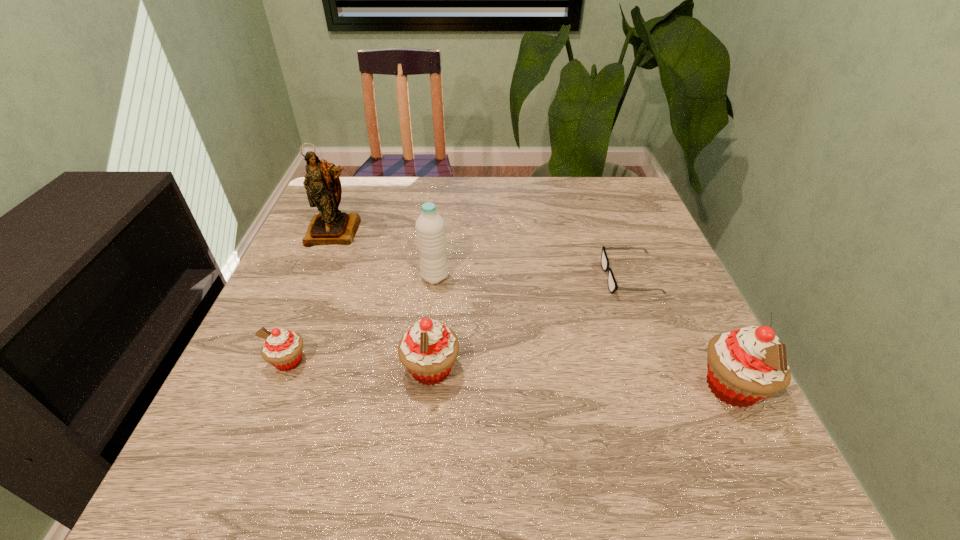
Where is `free space located on the left of the second shortest cupcake`? free space located on the left of the second shortest cupcake is located at coordinates (271, 369).

In order to click on free point located on the left of the rightmost cupcake in this screenshot , I will do `click(478, 387)`.

Where is `vacant region located on the front-facing side of the spectacles`? The width and height of the screenshot is (960, 540). vacant region located on the front-facing side of the spectacles is located at coordinates (536, 278).

Where is `vacant area situated 0.200m on the front-facing side of the spectacles`? This screenshot has width=960, height=540. vacant area situated 0.200m on the front-facing side of the spectacles is located at coordinates (518, 278).

In order to click on free space located 0.110m on the front-facing side of the spectacles in this screenshot , I will do `click(557, 278)`.

Where is `vacant space located on the left of the water bottle`? vacant space located on the left of the water bottle is located at coordinates (378, 277).

The height and width of the screenshot is (540, 960). In order to click on vacant area situated 0.400m on the front-facing side of the farthest object in this screenshot , I will do `click(274, 381)`.

This screenshot has width=960, height=540. I want to click on object that is at the far edge, so click(x=331, y=226).

You are a GUI agent. You are given a task and a screenshot of the screen. Output one action in this format:
    pyautogui.click(x=<x>, y=<y>)
    Task: Click on the cupcake present at the left edge
    
    Given the screenshot: What is the action you would take?
    pyautogui.click(x=282, y=348)

The width and height of the screenshot is (960, 540). I want to click on figurine present at the left edge, so click(331, 226).